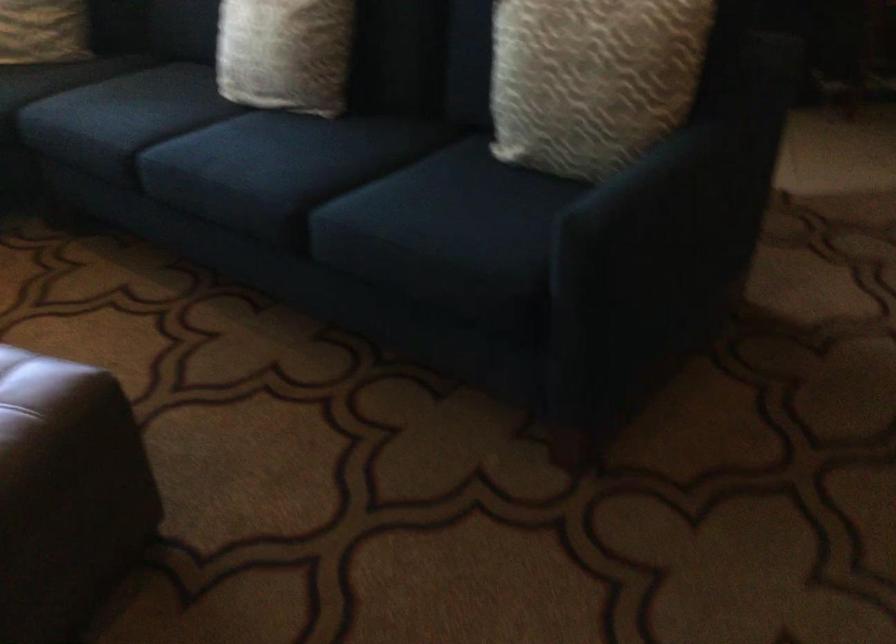
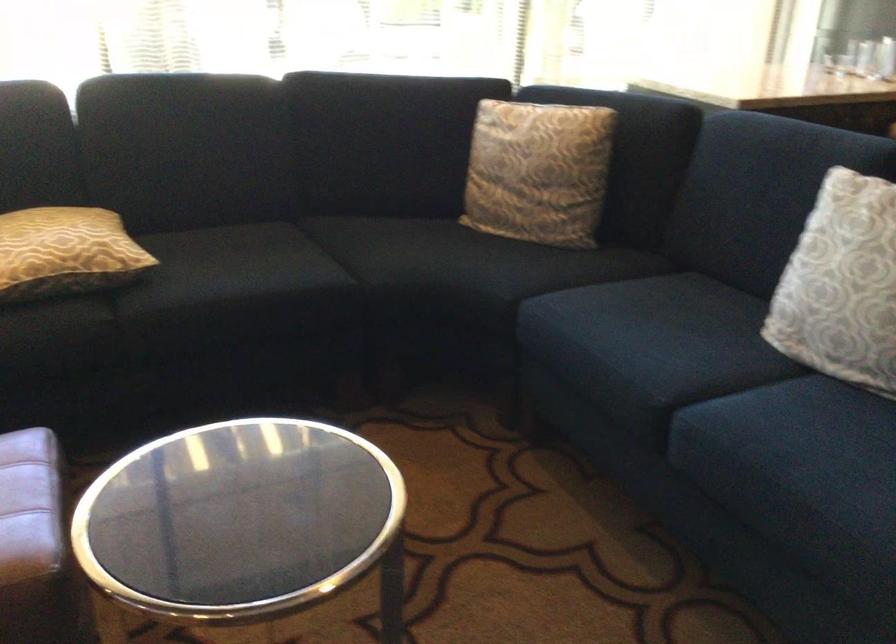
Question: Based on the continuous images, in which direction is the camera rotating? Reply with the corresponding letter.

Choices:
 (A) Left
 (B) Right
 (C) Up
 (D) Down

Answer: (A)